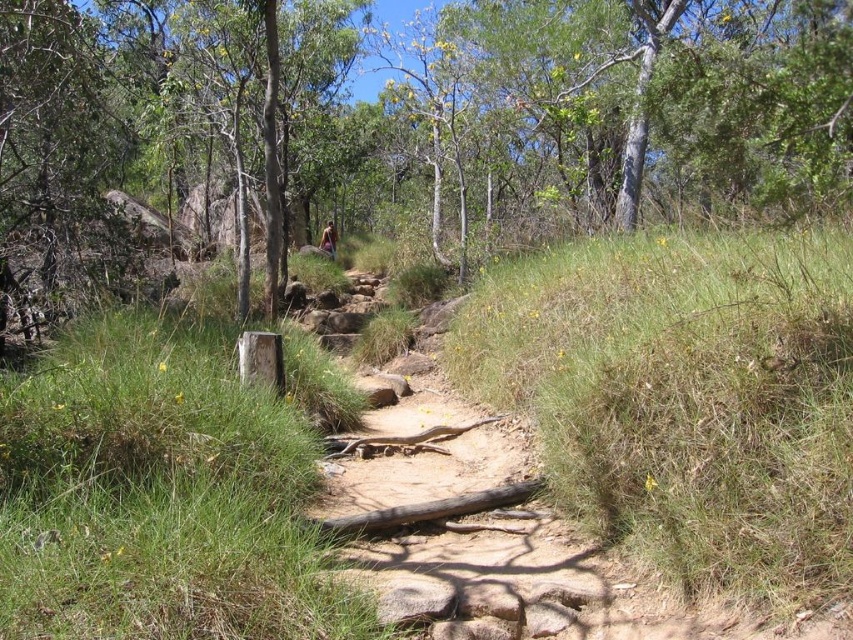
Who is positioned more to the right, green leafy tree at center or brown leather jacket at center?

Positioned to the right is green leafy tree at center.

Is green leafy tree at center to the left of brown leather jacket at center from the viewer's perspective?

No, green leafy tree at center is not to the left of brown leather jacket at center.

Which is behind, point (728, 221) or point (328, 248)?

The point (328, 248) is more distant.

At what (x,y) coordinates should I click in order to perform the action: click on green leafy tree at center. Please return your answer as a coordinate pair (x, y). The width and height of the screenshot is (853, 640). Looking at the image, I should click on (399, 131).